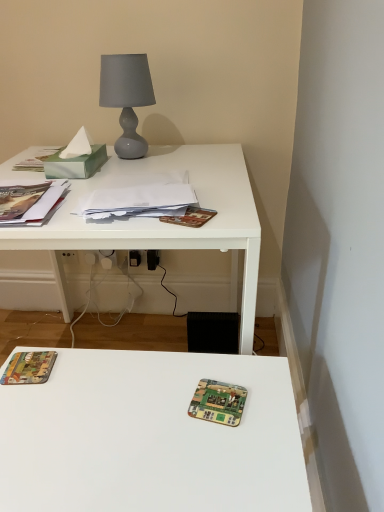
This screenshot has width=384, height=512. In order to click on vacant space behind brown textured paper at center, the first paperback book from the top in this screenshot , I will do `click(215, 190)`.